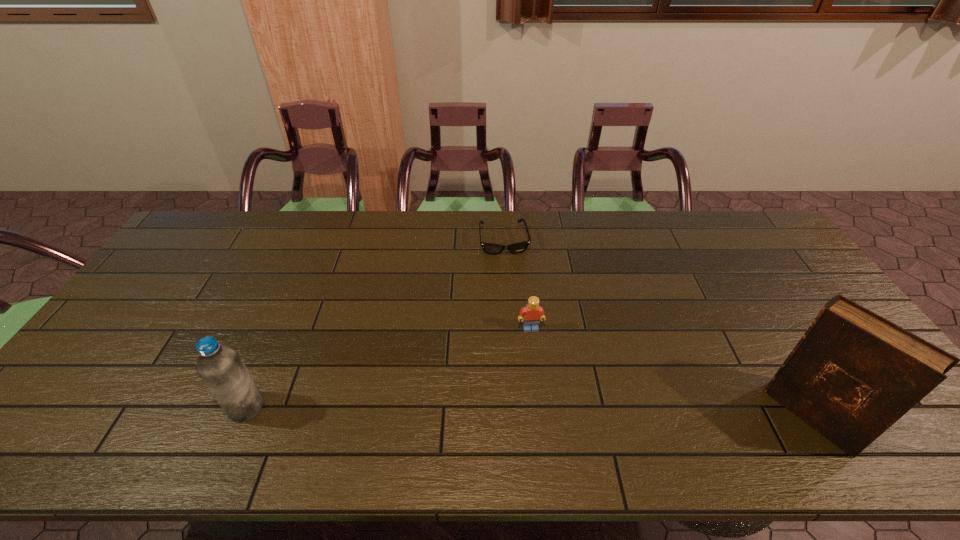
This screenshot has height=540, width=960. I want to click on the second tallest object, so (220, 367).

Locate an element on the screen. The height and width of the screenshot is (540, 960). water bottle is located at coordinates (220, 367).

I want to click on the tallest object, so click(x=853, y=374).

Find the location of a particular element. The height and width of the screenshot is (540, 960). the rightmost object is located at coordinates (853, 374).

Locate an element on the screen. the third nearest object is located at coordinates (533, 313).

At what (x,y) coordinates should I click in order to perform the action: click on the second shortest object. Please return your answer as a coordinate pair (x, y). The height and width of the screenshot is (540, 960). Looking at the image, I should click on (533, 313).

You are a GUI agent. You are given a task and a screenshot of the screen. Output one action in this format:
    pyautogui.click(x=<x>, y=<y>)
    Task: Click on the farthest object
    The width and height of the screenshot is (960, 540).
    Given the screenshot: What is the action you would take?
    pyautogui.click(x=490, y=248)

This screenshot has height=540, width=960. Identify the location of the shortest object. (490, 248).

Identify the location of vacant space located on the left of the leftmost object. This screenshot has height=540, width=960. (170, 407).

Locate an element on the screen. vacant space situated 0.060m on the left of the rightmost object is located at coordinates (750, 415).